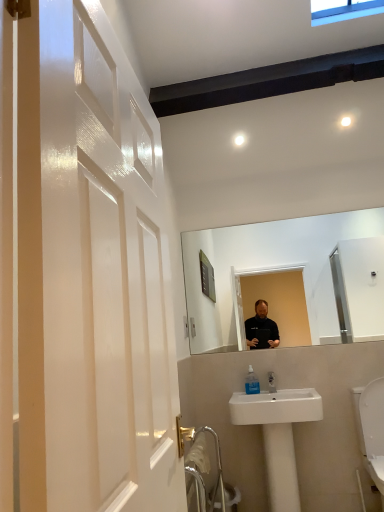
Measure the distance between point (x=257, y=383) and camera.

Point (x=257, y=383) and camera are 2.84 meters apart from each other.

The height and width of the screenshot is (512, 384). Describe the element at coordinates (252, 382) in the screenshot. I see `clear plastic soap dispenser at lower center` at that location.

I want to click on clear plastic soap dispenser at lower center, so click(252, 382).

Where is `white ceramic sink at lower center`? white ceramic sink at lower center is located at coordinates (278, 435).

Image resolution: width=384 pixels, height=512 pixels. Describe the element at coordinates (278, 435) in the screenshot. I see `white ceramic sink at lower center` at that location.

This screenshot has width=384, height=512. In order to click on clear plastic soap dispenser at lower center in this screenshot , I will do `click(252, 382)`.

Does white ceramic sink at lower center appear on the left side of clear plastic soap dispenser at lower center?

No, white ceramic sink at lower center is not to the left of clear plastic soap dispenser at lower center.

Considering the relative positions of white ceramic sink at lower center and clear plastic soap dispenser at lower center in the image provided, is white ceramic sink at lower center behind clear plastic soap dispenser at lower center?

No, it is not.

Considering the positions of points (289, 437) and (251, 384), is point (289, 437) farther from camera compared to point (251, 384)?

No.

From the image's perspective, which is above, white ceramic sink at lower center or clear plastic soap dispenser at lower center?

From the image's view, clear plastic soap dispenser at lower center is above.

From a real-world perspective, is white ceramic sink at lower center beneath clear plastic soap dispenser at lower center?

Yes, from a real-world perspective, white ceramic sink at lower center is below clear plastic soap dispenser at lower center.

Between white ceramic sink at lower center and clear plastic soap dispenser at lower center, which one has larger width?

white ceramic sink at lower center is wider.

Considering the relative sizes of white ceramic sink at lower center and clear plastic soap dispenser at lower center in the image provided, is white ceramic sink at lower center shorter than clear plastic soap dispenser at lower center?

Incorrect, the height of white ceramic sink at lower center does not fall short of that of clear plastic soap dispenser at lower center.

Looking at the image, does white ceramic sink at lower center seem bigger or smaller compared to clear plastic soap dispenser at lower center?

Clearly, white ceramic sink at lower center is larger in size than clear plastic soap dispenser at lower center.

Which is correct: white ceramic sink at lower center is inside clear plastic soap dispenser at lower center, or outside of it?

white ceramic sink at lower center lies outside clear plastic soap dispenser at lower center.

Is the surface of white ceramic sink at lower center in direct contact with clear plastic soap dispenser at lower center?

No, white ceramic sink at lower center is not beside clear plastic soap dispenser at lower center.

Does white ceramic sink at lower center turn towards clear plastic soap dispenser at lower center?

No, white ceramic sink at lower center is not turned towards clear plastic soap dispenser at lower center.

How much distance is there between white ceramic sink at lower center and clear plastic soap dispenser at lower center?

white ceramic sink at lower center and clear plastic soap dispenser at lower center are 15.95 inches apart.

Identify the location of sink directly beneath the clear plastic soap dispenser at lower center (from a real-world perspective). Image resolution: width=384 pixels, height=512 pixels. (278, 435).

Can you confirm if clear plastic soap dispenser at lower center is positioned to the left of white ceramic sink at lower center?

Indeed, clear plastic soap dispenser at lower center is positioned on the left side of white ceramic sink at lower center.

Is clear plastic soap dispenser at lower center further to the viewer compared to white ceramic sink at lower center?

Yes, clear plastic soap dispenser at lower center is behind white ceramic sink at lower center.

Is point (259, 384) closer or farther from the camera than point (273, 424)?

Point (259, 384) is farther from the camera than point (273, 424).

Looking at this image, from the image's perspective, is clear plastic soap dispenser at lower center over white ceramic sink at lower center?

Yes, from the image's perspective, clear plastic soap dispenser at lower center is above white ceramic sink at lower center.

From a real-world perspective, who is located lower, clear plastic soap dispenser at lower center or white ceramic sink at lower center?

In real-world perspective, white ceramic sink at lower center is lower.

Which of these two, clear plastic soap dispenser at lower center or white ceramic sink at lower center, is thinner?

clear plastic soap dispenser at lower center.

Is clear plastic soap dispenser at lower center taller than white ceramic sink at lower center?

No, clear plastic soap dispenser at lower center is not taller than white ceramic sink at lower center.

Between clear plastic soap dispenser at lower center and white ceramic sink at lower center, which one has larger size?

white ceramic sink at lower center is bigger.

Looking at this image, is white ceramic sink at lower center a part of clear plastic soap dispenser at lower center?

No, clear plastic soap dispenser at lower center does not contain white ceramic sink at lower center.

Is clear plastic soap dispenser at lower center not close to white ceramic sink at lower center?

No, clear plastic soap dispenser at lower center is in close proximity to white ceramic sink at lower center.

Could you tell me if clear plastic soap dispenser at lower center is facing white ceramic sink at lower center?

Yes, clear plastic soap dispenser at lower center is facing white ceramic sink at lower center.

The width and height of the screenshot is (384, 512). Identify the location of toiletry above the white ceramic sink at lower center (from a real-world perspective). (252, 382).

Identify the location of sink below the clear plastic soap dispenser at lower center (from a real-world perspective). The image size is (384, 512). (278, 435).

At what (x,y) coordinates should I click in order to perform the action: click on sink on the right of clear plastic soap dispenser at lower center. Please return your answer as a coordinate pair (x, y). Image resolution: width=384 pixels, height=512 pixels. Looking at the image, I should click on (278, 435).